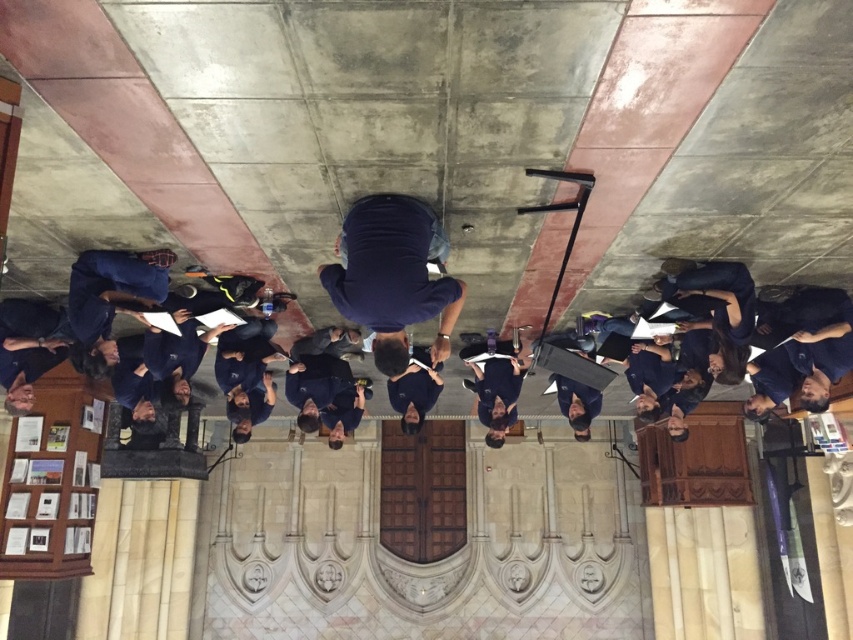
Question: Is dark blue shirt at center further to camera compared to dark blue uniform at center?

Choices:
 (A) yes
 (B) no

Answer: (B)

Question: Among these objects, which one is farthest from the camera?

Choices:
 (A) dark blue uniform at center
 (B) dark blue shirt at center

Answer: (A)

Question: Considering the relative positions of dark blue shirt at center and dark blue uniform at center in the image provided, where is dark blue shirt at center located with respect to dark blue uniform at center?

Choices:
 (A) left
 (B) right

Answer: (A)

Question: Is dark blue shirt at center to the left of dark blue uniform at center from the viewer's perspective?

Choices:
 (A) no
 (B) yes

Answer: (B)